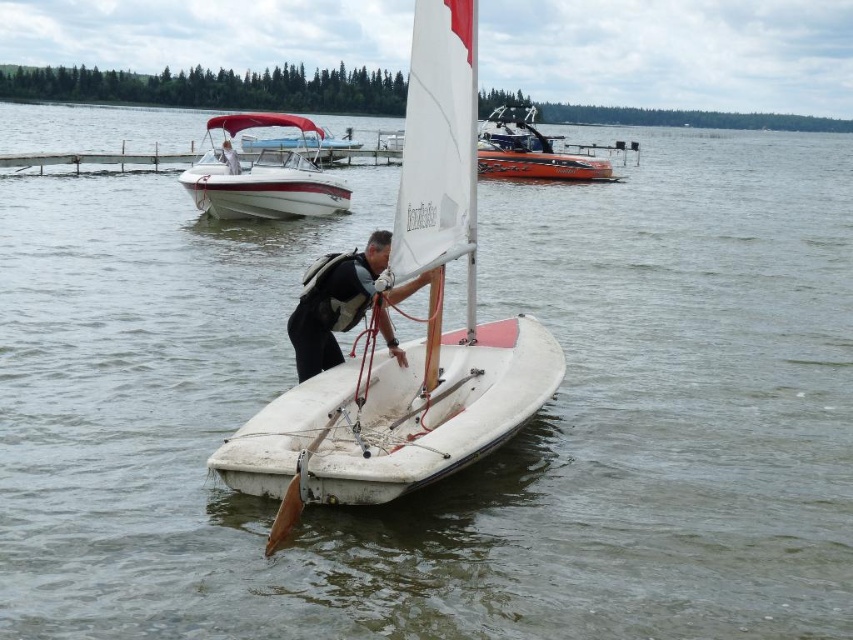
Can you confirm if white matte sailboat at center is taller than black fabric person at center?

Correct, white matte sailboat at center is much taller as black fabric person at center.

Looking at this image, is white matte sailboat at center shorter than black fabric person at center?

No, white matte sailboat at center is not shorter than black fabric person at center.

Identify the location of white matte sailboat at center. Image resolution: width=853 pixels, height=640 pixels. (412, 340).

Which of these two, white glossy boat at upper left or black fabric vest at center, stands shorter?

With less height is black fabric vest at center.

Does white glossy boat at upper left have a lesser height compared to black fabric vest at center?

Incorrect, white glossy boat at upper left's height does not fall short of black fabric vest at center's.

Measure the distance between point (286, 124) and camera.

They are 29.68 meters apart.

Where is `white glossy boat at upper left`? The height and width of the screenshot is (640, 853). white glossy boat at upper left is located at coordinates (265, 176).

Between orange fiberglass boat at upper center and black fabric person at center, which one has less height?

Standing shorter between the two is black fabric person at center.

Between point (567, 145) and point (231, 157), which one is positioned behind?

Positioned behind is point (567, 145).

I want to click on orange fiberglass boat at upper center, so click(531, 150).